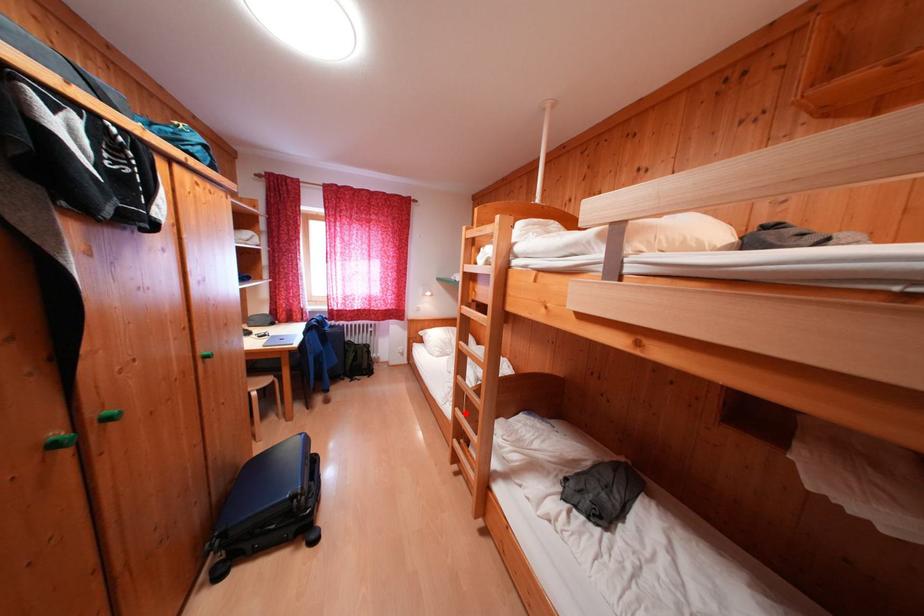
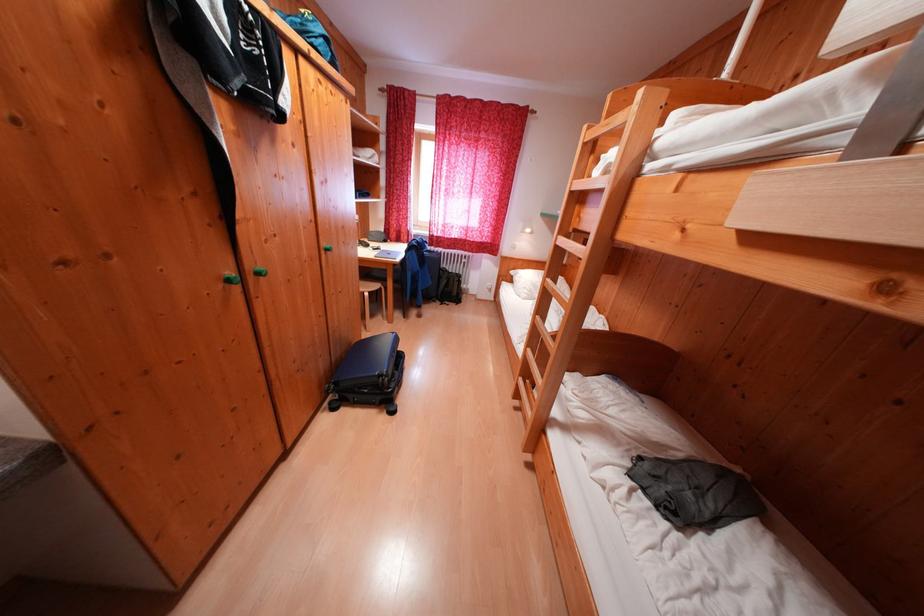
Locate, in the second image, the point that corresponds to the highlighted location in the first image.

(537, 354)